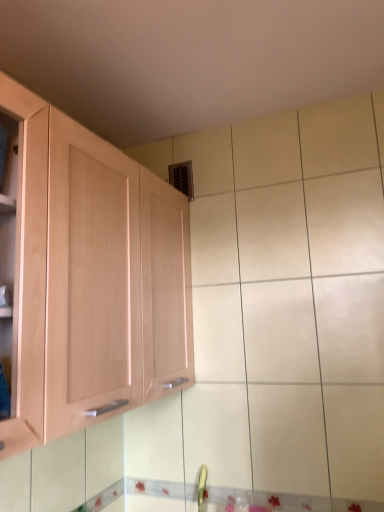
Question: Should I look upward or downward to see light wood cabinet at left?

Choices:
 (A) down
 (B) up

Answer: (A)